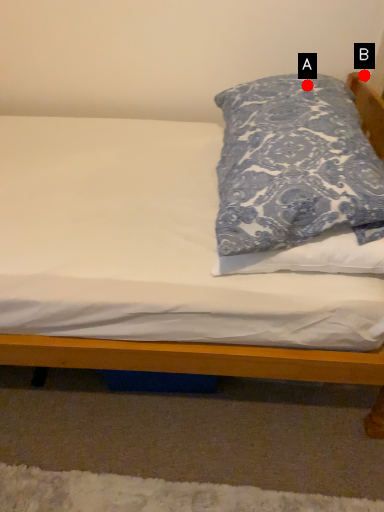
Question: Two points are circled on the image, labeled by A and B beside each circle. Which of the following is the farthest from the observer?

Choices:
 (A) A is further
 (B) B is further

Answer: (B)